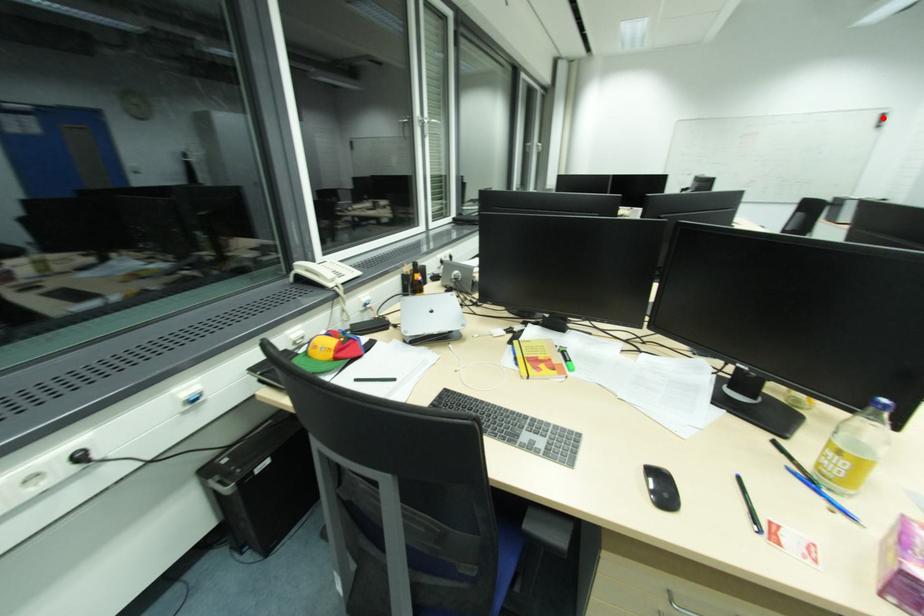
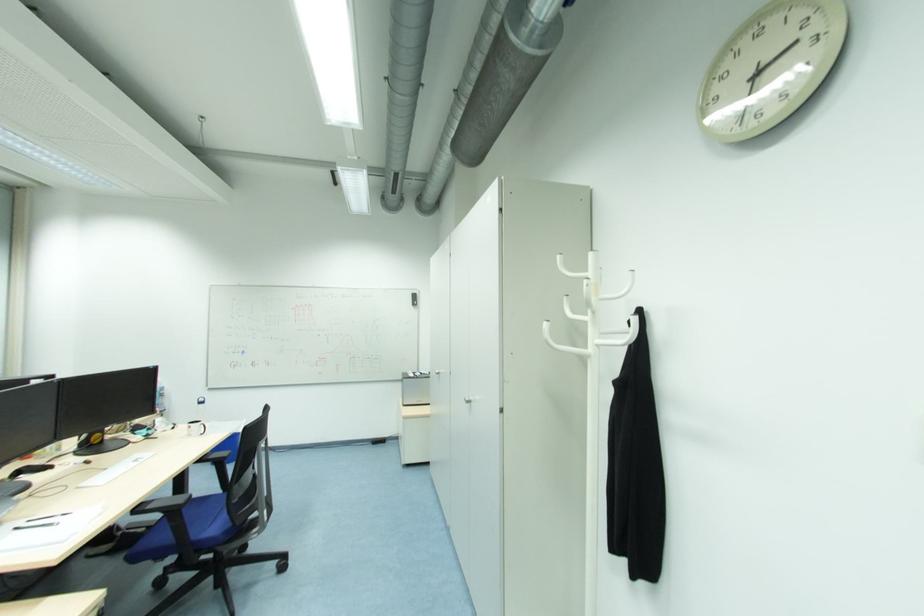
Question: I am providing you with two images of the same scene from different viewpoints. In image1, a red point is highlighted. Considering the same 3D point in image2, which of the following is correct?

Choices:
 (A) It is closer
 (B) It is farther

Answer: (A)